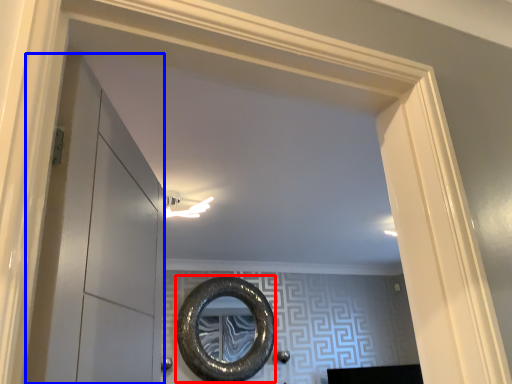
Question: Which object is closer to the camera taking this photo, oval (highlighted by a red box) or glass door (highlighted by a blue box)?

Choices:
 (A) oval
 (B) glass door

Answer: (B)